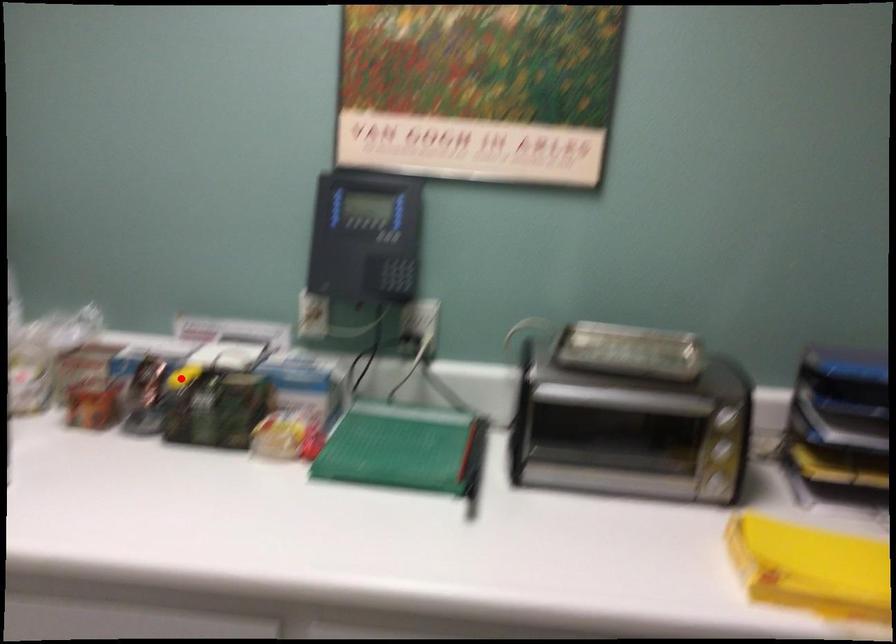
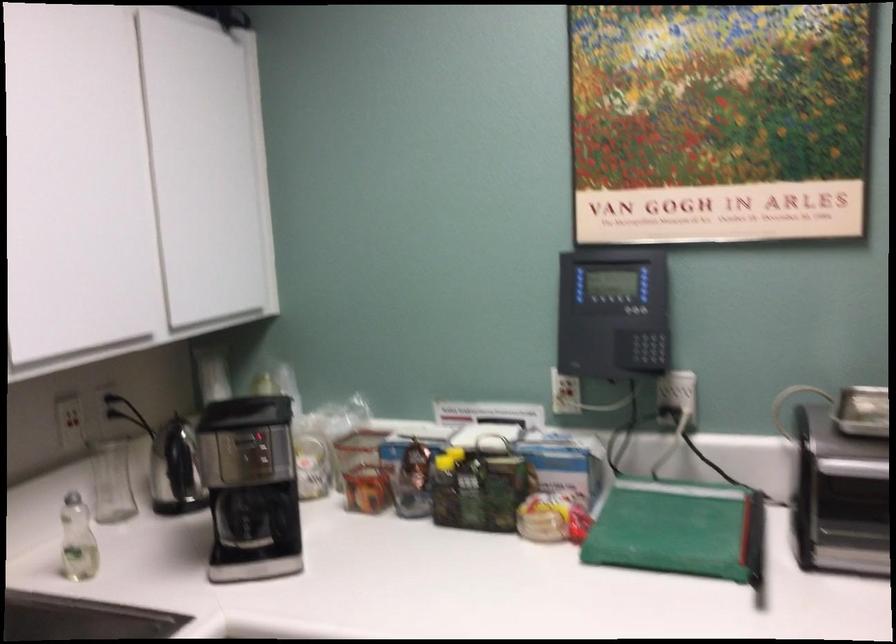
Question: I am providing you with two images of the same scene from different viewpoints. A red point is marked on the first image. Is the red point's position out of view in image 2?

Choices:
 (A) Yes
 (B) No

Answer: (B)